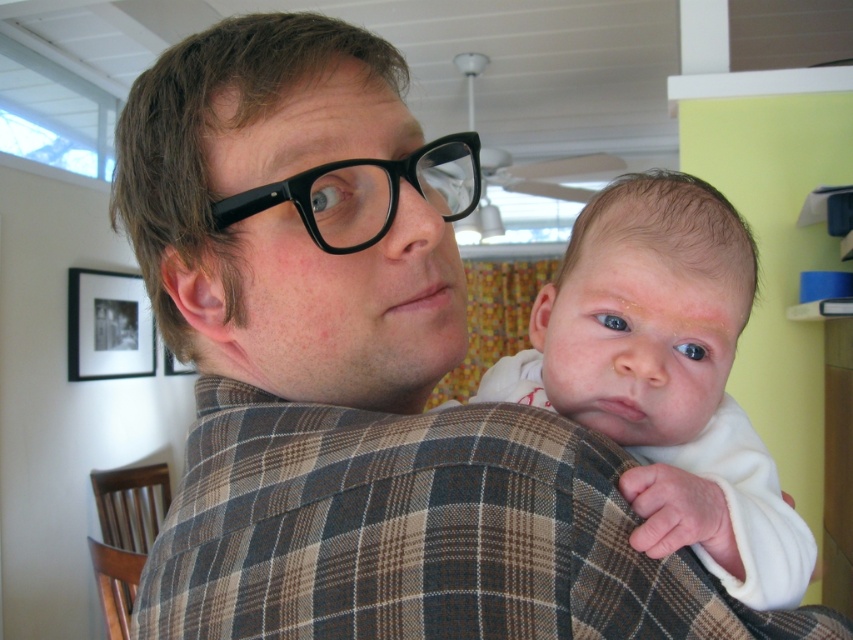
Question: Is white soft baby at center below black plastic glasses at center?

Choices:
 (A) no
 (B) yes

Answer: (B)

Question: Is white soft baby at center above black plastic glasses at center?

Choices:
 (A) no
 (B) yes

Answer: (A)

Question: Which point is farther to the camera?

Choices:
 (A) (666, 440)
 (B) (363, 237)

Answer: (A)

Question: Is white soft baby at center closer to the viewer compared to black plastic glasses at center?

Choices:
 (A) yes
 (B) no

Answer: (A)